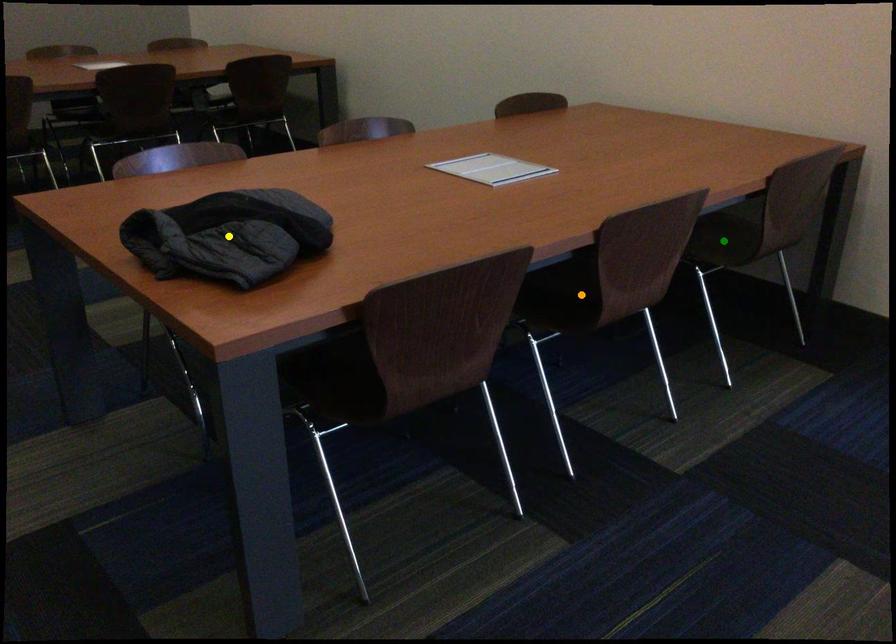
Order these from nearest to farthest:
1. green point
2. yellow point
3. orange point

yellow point, orange point, green point